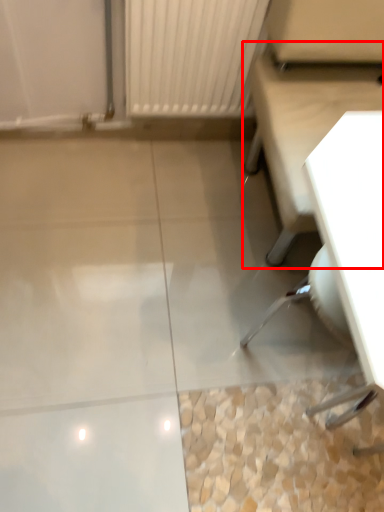
Question: Considering the relative positions of furniture (annotated by the red box) and swivel chair in the image provided, where is furniture (annotated by the red box) located with respect to the staircase?

Choices:
 (A) left
 (B) right

Answer: (B)